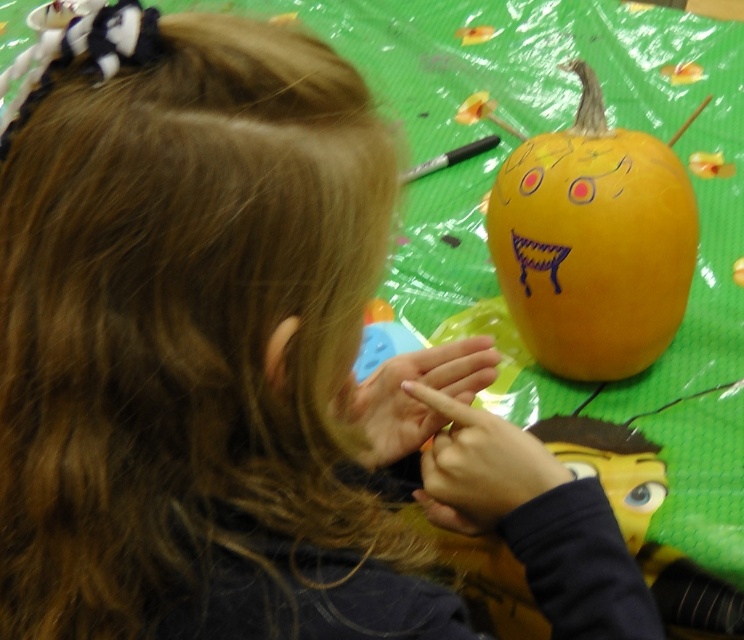
Question: Does matte orange pumpkin at center lie in front of smooth yellow face at center?

Choices:
 (A) yes
 (B) no

Answer: (B)

Question: Is matte orange pumpkin at center positioned before smooth yellow face at center?

Choices:
 (A) no
 (B) yes

Answer: (A)

Question: Does matte orange pumpkin at center appear on the right side of smooth yellow face at center?

Choices:
 (A) yes
 (B) no

Answer: (A)

Question: Which object is closer to the camera taking this photo?

Choices:
 (A) matte orange pumpkin at center
 (B) smooth yellow face at center

Answer: (B)

Question: Among these objects, which one is nearest to the camera?

Choices:
 (A) matte orange pumpkin at center
 (B) smooth yellow face at center

Answer: (B)

Question: Which of the following is the closest to the observer?

Choices:
 (A) smooth yellow face at center
 (B) matte orange pumpkin at center

Answer: (A)